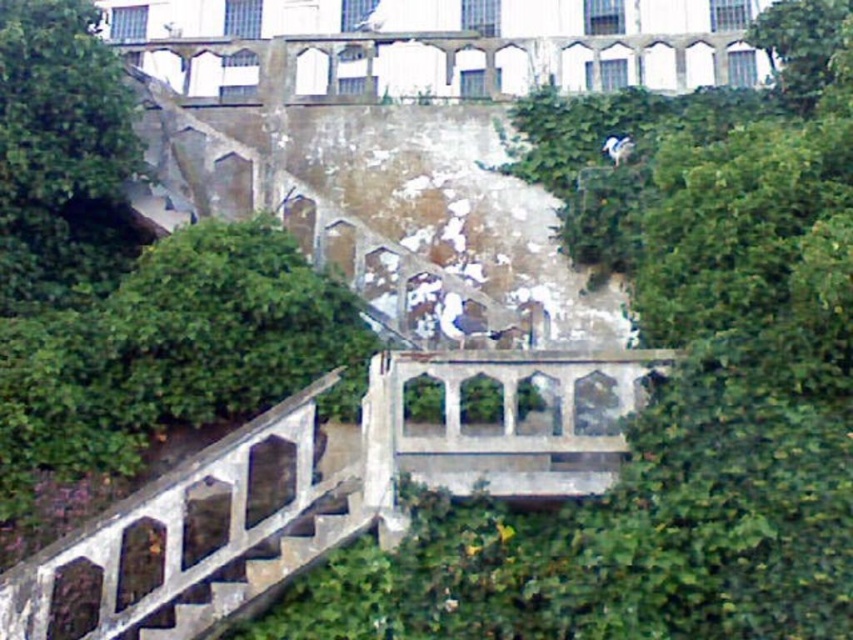
Question: Which of the following is the closest to the observer?

Choices:
 (A) (756, 19)
 (B) (38, 122)

Answer: (B)

Question: Where is green leafy tree at upper left located in relation to green leafy tree at left in the image?

Choices:
 (A) below
 (B) above

Answer: (A)

Question: Does green leafy tree at upper left appear over green leafy tree at left?

Choices:
 (A) yes
 (B) no

Answer: (B)

Question: Based on their relative distances, which object is nearer to the green leafy tree at upper left?

Choices:
 (A) green leafy tree at left
 (B) green leafy tree at upper right

Answer: (A)

Question: Observing the image, what is the correct spatial positioning of green leafy tree at left in reference to green leafy tree at upper right?

Choices:
 (A) right
 (B) left

Answer: (B)

Question: Which point is closer to the camera taking this photo?

Choices:
 (A) tap(788, 20)
 (B) tap(3, 113)

Answer: (B)